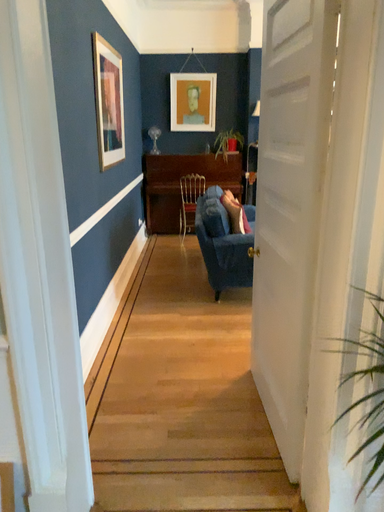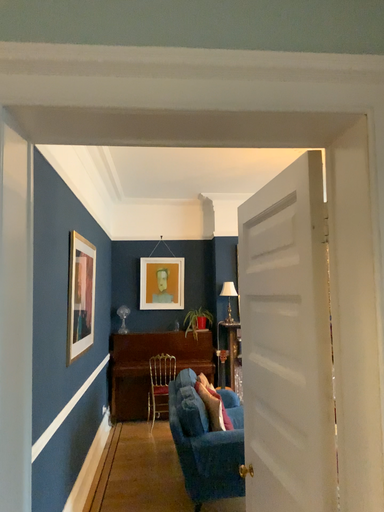
Question: How did the camera likely rotate when shooting the video?

Choices:
 (A) rotated upward
 (B) rotated downward

Answer: (A)